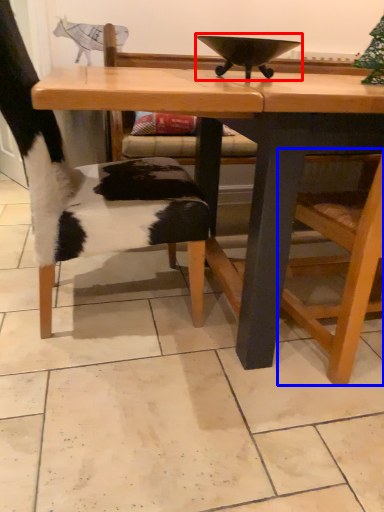
Question: Which of the following is the farthest to the observer, bowl (highlighted by a red box) or armchair (highlighted by a blue box)?

Choices:
 (A) bowl
 (B) armchair

Answer: (A)